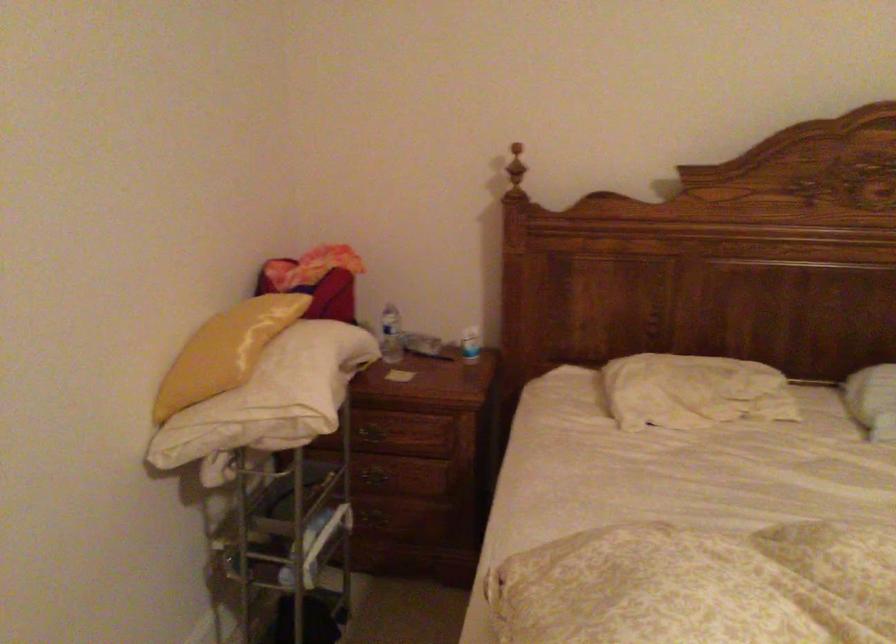
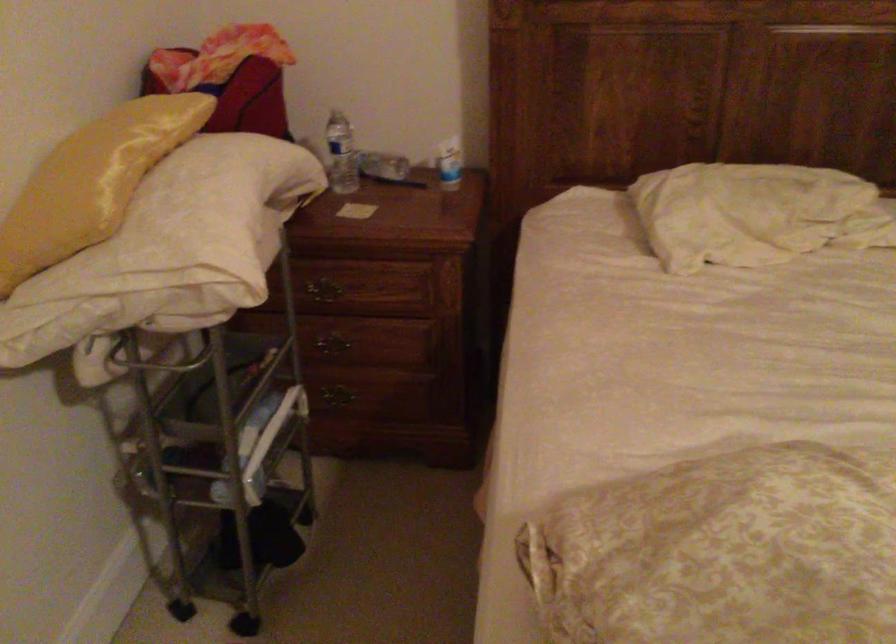
Question: The images are taken continuously from a first-person perspective. In which direction are you moving?

Choices:
 (A) Left
 (B) Right
 (C) Forward
 (D) Backward

Answer: (C)